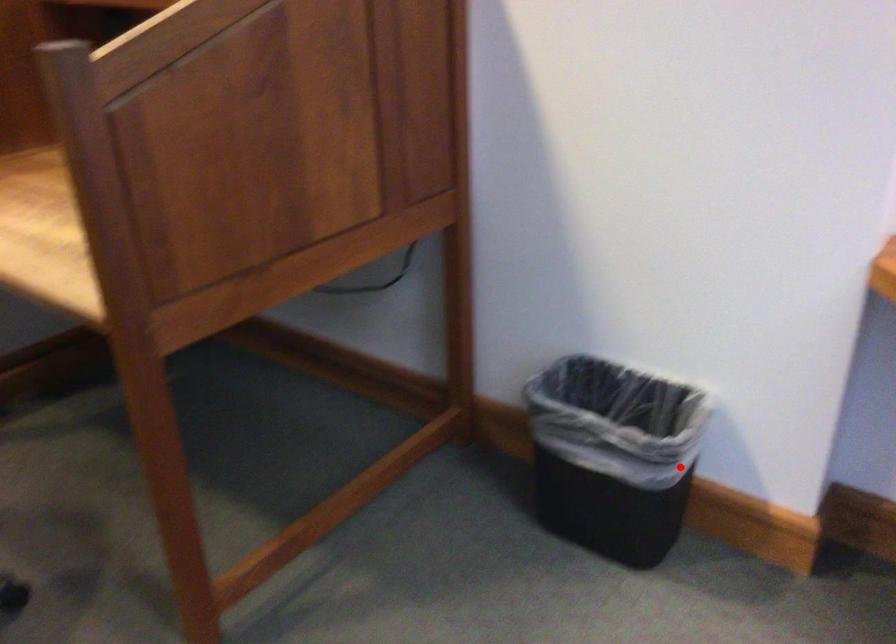
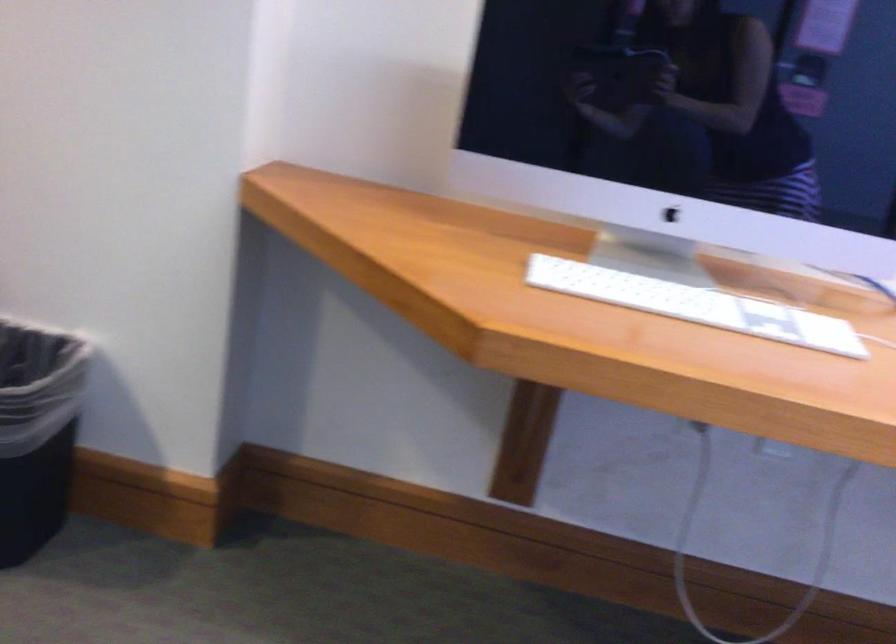
Find the pixel in the second image that matches the highlighted location in the first image.

(37, 431)